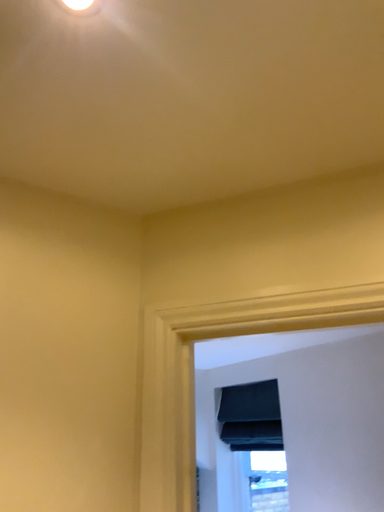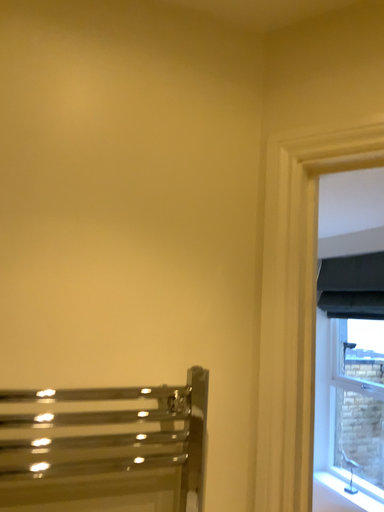
Question: How did the camera likely rotate when shooting the video?

Choices:
 (A) rotated left
 (B) rotated right

Answer: (A)